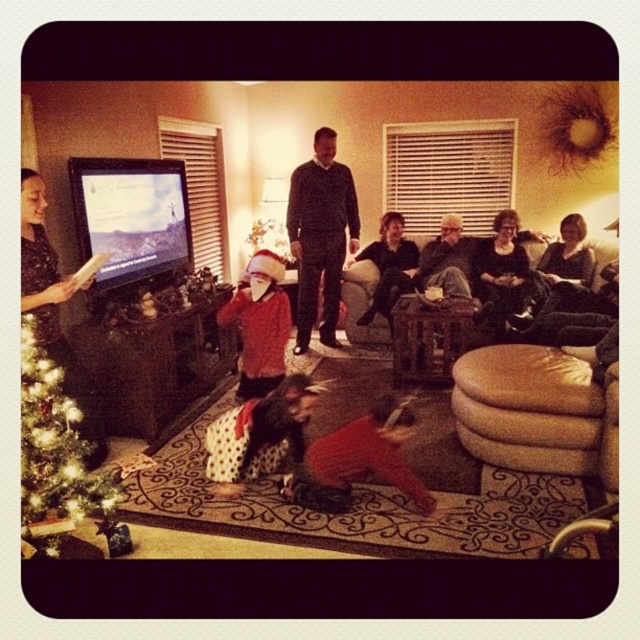
You are planning to take a photo of the green glittering christmas tree at lower left and the velvet red pajamas at lower center. Which object should you focus on first if you want to capture both in a single frame without moving the camera?

You should focus on the green glittering christmas tree at lower left first because it is larger and will require more attention in the frame to ensure both objects are properly captured.

You are standing in the room and want to take a photo of the dark gray sweater at center without the green glittering christmas tree at lower left blocking the view. Is this possible?

The green glittering christmas tree at lower left is in front of the dark gray sweater at center, so you cannot take a photo of the dark gray sweater at center without the tree blocking the view.